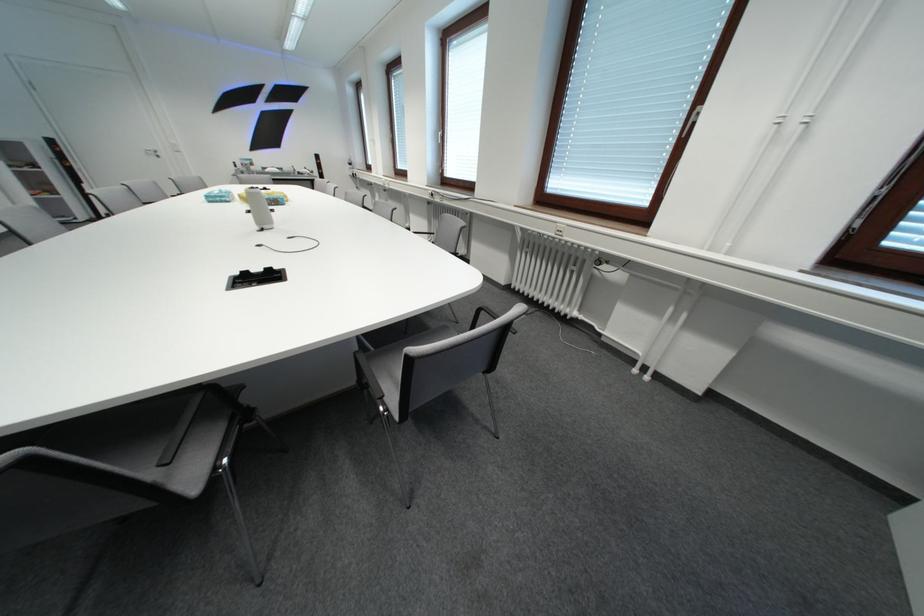
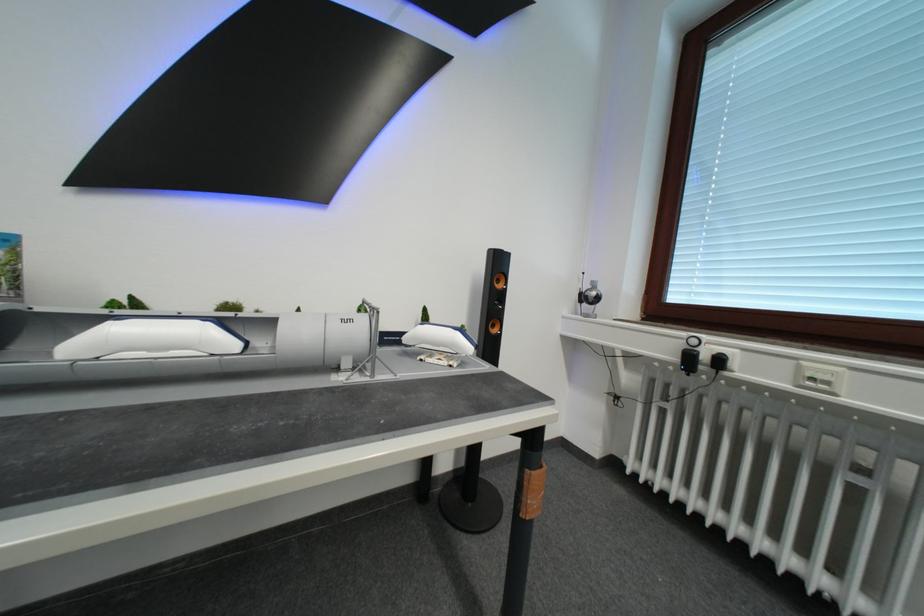
Locate, in the second image, the point that corresponds to (x=327, y=159) in the first image.

(507, 265)